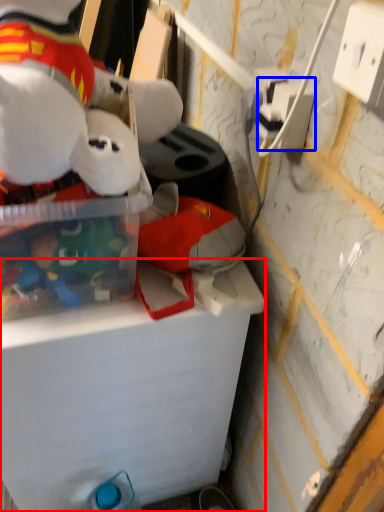
Question: Which of the following is the farthest to the observer, cardboard box (highlighted by a red box) or power outlet (highlighted by a blue box)?

Choices:
 (A) cardboard box
 (B) power outlet

Answer: (A)